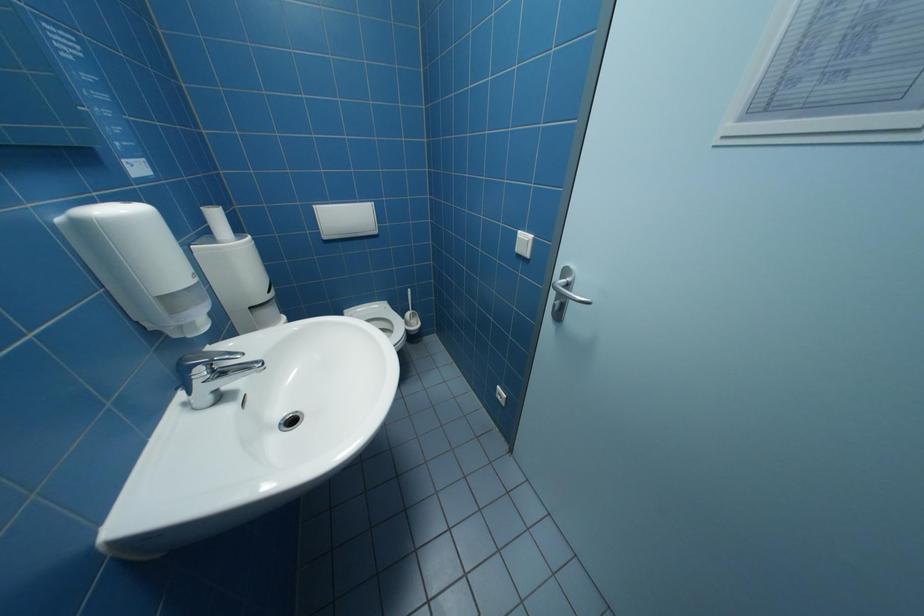
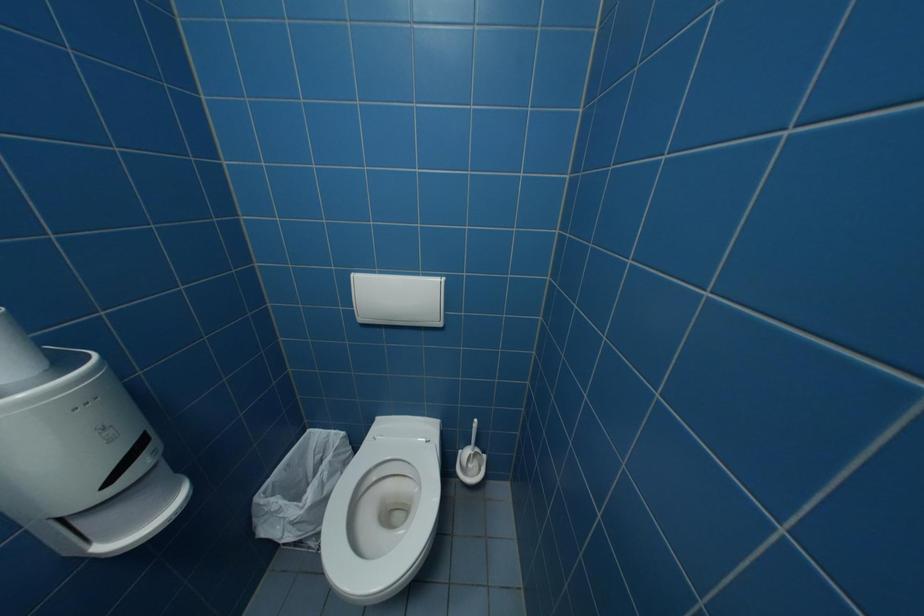
Question: The images are taken continuously from a first-person perspective. In which direction are you moving?

Choices:
 (A) Left
 (B) Right
 (C) Forward
 (D) Backward

Answer: (C)